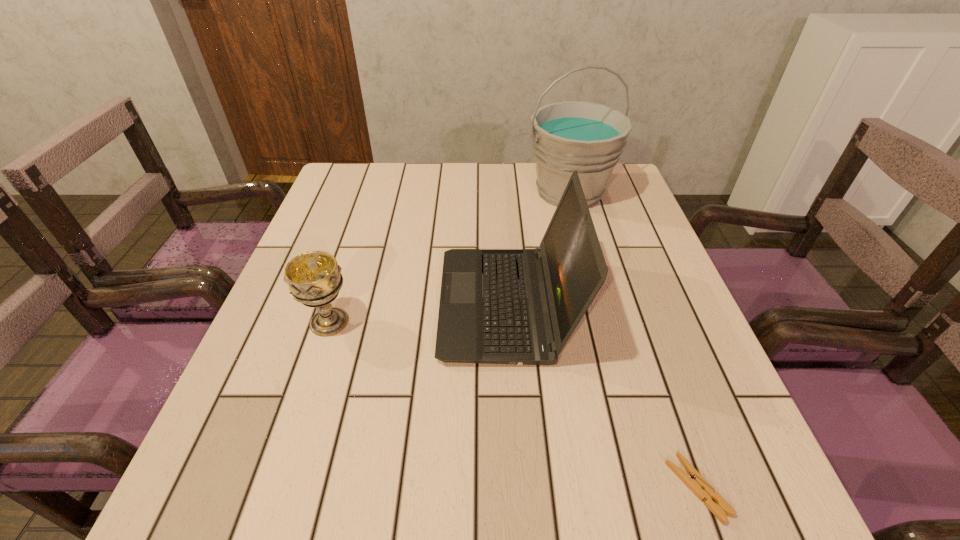
Image resolution: width=960 pixels, height=540 pixels. What are the coordinates of `free point between the nearest object and the chalice` in the screenshot? It's located at click(514, 405).

Identify the location of free space between the third tallest object and the third shortest object. (418, 313).

At what (x,y) coordinates should I click in order to perform the action: click on free point between the bucket and the clothespin. Please return your answer as a coordinate pair (x, y). Looking at the image, I should click on (634, 340).

Where is `vacant space that is in between the nearest object and the leftmost object`? The width and height of the screenshot is (960, 540). vacant space that is in between the nearest object and the leftmost object is located at coordinates [514, 405].

You are a GUI agent. You are given a task and a screenshot of the screen. Output one action in this format:
    pyautogui.click(x=<x>, y=<y>)
    Task: Click on the empty location between the chalice and the nearest object
    
    Given the screenshot: What is the action you would take?
    pyautogui.click(x=514, y=405)

The image size is (960, 540). Find the location of `unoccupied position between the laptop_computer and the shortest object`. unoccupied position between the laptop_computer and the shortest object is located at coordinates (602, 396).

You are a GUI agent. You are given a task and a screenshot of the screen. Output one action in this format:
    pyautogui.click(x=<x>, y=<y>)
    Task: Click on the object that ranks as the second closest to the clothespin
    The image size is (960, 540).
    Given the screenshot: What is the action you would take?
    pyautogui.click(x=314, y=278)

Locate which object ranks second in proximity to the shortest object. Please provide its 2D coordinates. Your answer should be formatted as a tuple, i.e. [(x, y)], where the tuple contains the x and y coordinates of a point satisfying the conditions above.

[(314, 278)]

At what (x,y) coordinates should I click in order to perform the action: click on free space that satisfies the following two spatial constraints: 1. on the back side of the clothespin; 2. on the screen of the laptop_computer. Please return your answer as a coordinate pair (x, y). The width and height of the screenshot is (960, 540). Looking at the image, I should click on (634, 305).

At what (x,y) coordinates should I click in order to perform the action: click on vacant space that satisfies the following two spatial constraints: 1. on the front side of the nearest object; 2. on the right side of the farthest object. Please return your answer as a coordinate pair (x, y). The width and height of the screenshot is (960, 540). Looking at the image, I should click on (651, 488).